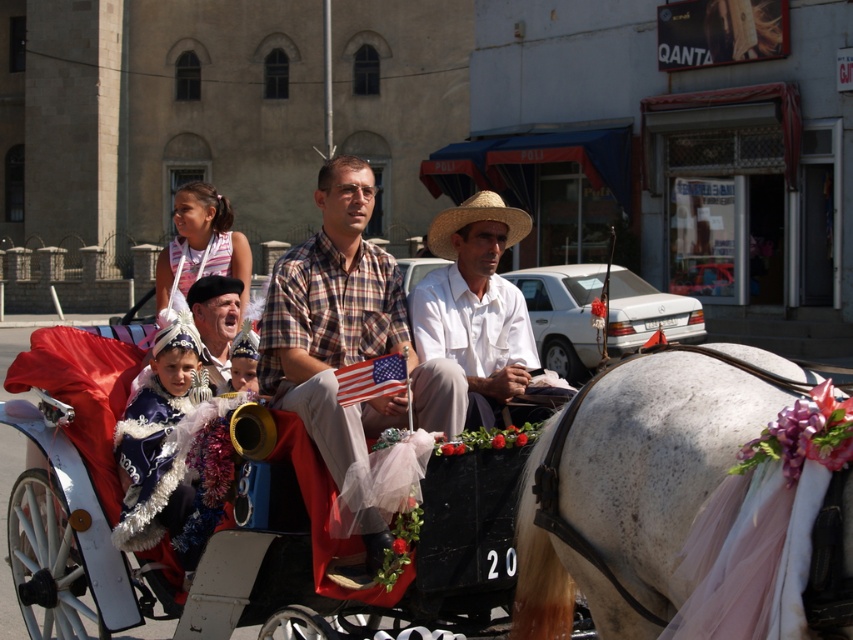
Question: Based on their relative distances, which object is farther from the pink striped dress at upper left?

Choices:
 (A) plaid fabric shirt at center
 (B) matte black beret at center
 (C) strawmaterial/texturecowboy hat at center
 (D) white cotton shirt at center

Answer: (D)

Question: Estimate the real-world distances between objects in this image. Which object is farther from the pink striped dress at upper left?

Choices:
 (A) plaid fabric shirt at center
 (B) white glossy horse at center
 (C) white cotton shirt at center

Answer: (C)

Question: Is white cotton shirt at center below pink striped dress at upper left?

Choices:
 (A) no
 (B) yes

Answer: (B)

Question: Which object appears farthest from the camera in this image?

Choices:
 (A) strawmaterial/texturecowboy hat at center
 (B) plaid fabric shirt at center
 (C) white cotton shirt at center
 (D) pink striped dress at upper left

Answer: (D)

Question: Is matte black beret at center positioned in front of strawmaterial/texturecowboy hat at center?

Choices:
 (A) no
 (B) yes

Answer: (A)

Question: Observing the image, what is the correct spatial positioning of white glossy horse at center in reference to strawmaterial/texturecowboy hat at center?

Choices:
 (A) above
 (B) below

Answer: (B)